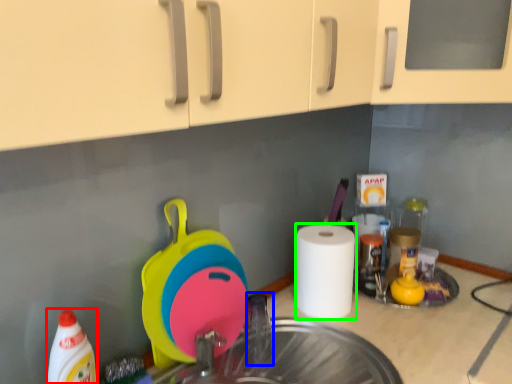
Question: Which is nearer to the cleaning product (highlighted by a red box)? faucet (highlighted by a blue box) or paper towel (highlighted by a green box).

Choices:
 (A) faucet
 (B) paper towel

Answer: (A)